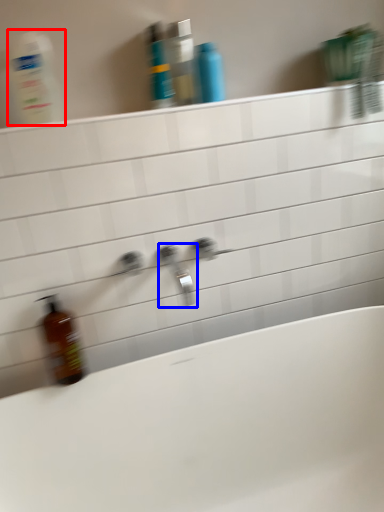
Question: Which object is closer to the camera taking this photo, cleaning product (highlighted by a red box) or tap (highlighted by a blue box)?

Choices:
 (A) cleaning product
 (B) tap

Answer: (A)